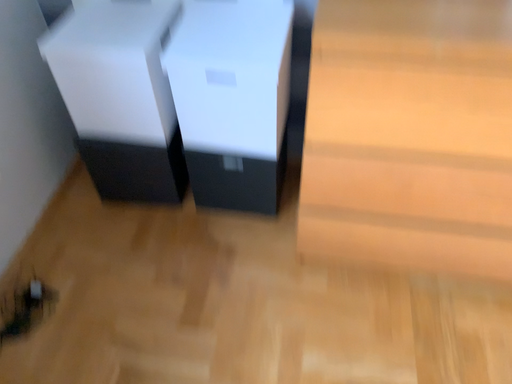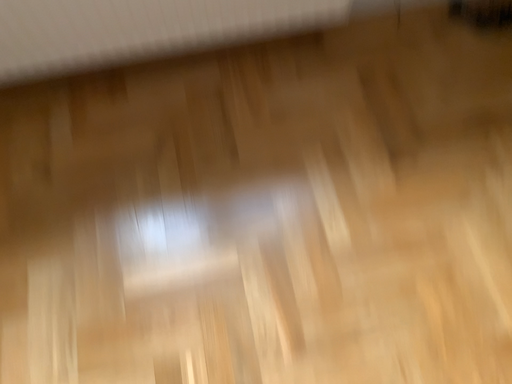
Question: How did the camera likely rotate when shooting the video?

Choices:
 (A) rotated right
 (B) rotated left

Answer: (B)